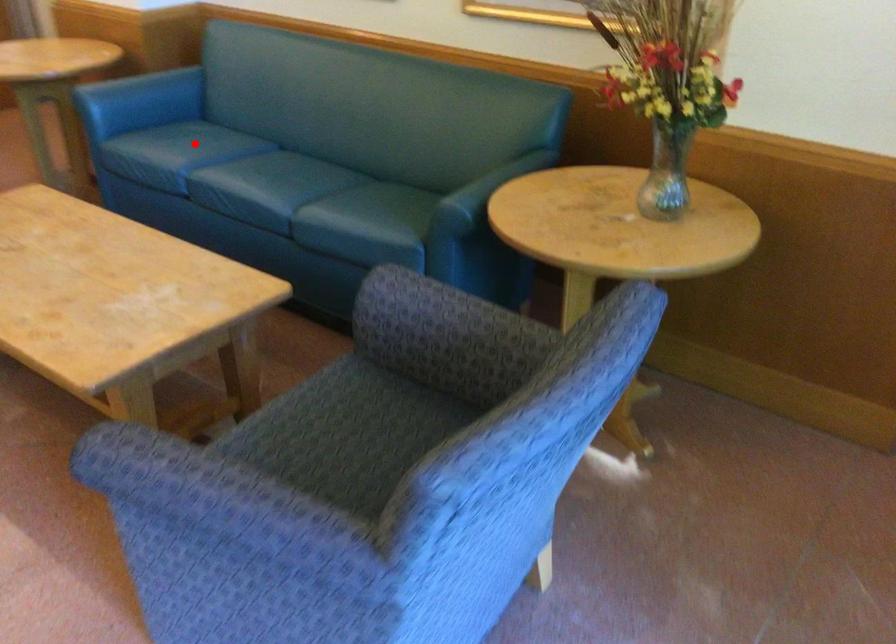
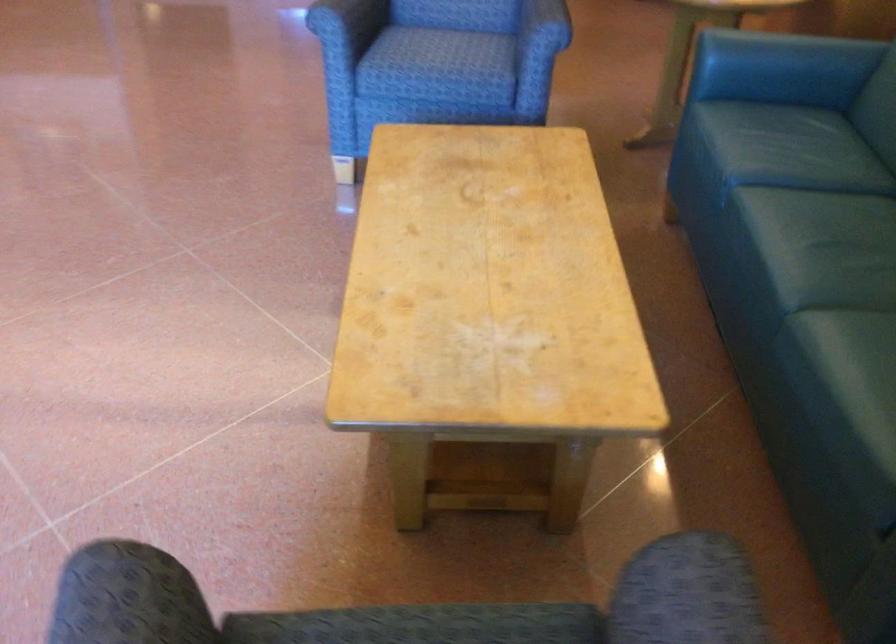
In the second image, find the point that corresponds to the highlighted location in the first image.

(776, 147)